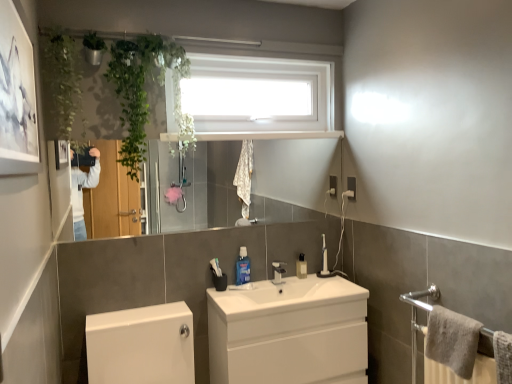
Question: Considering the relative sizes of white glossy toilet at lower left and translucent plastic bottle at center, which is the second toiletry from front to back, in the image provided, is white glossy toilet at lower left bigger than translucent plastic bottle at center, which is the second toiletry from front to back,?

Choices:
 (A) no
 (B) yes

Answer: (B)

Question: Is white glossy toilet at lower left smaller than translucent plastic bottle at center, which is the second toiletry from front to back?

Choices:
 (A) yes
 (B) no

Answer: (B)

Question: From a real-world perspective, does white glossy toilet at lower left sit lower than translucent plastic bottle at center, which is the 1th toiletry in right-to-left order?

Choices:
 (A) yes
 (B) no

Answer: (A)

Question: Does white glossy toilet at lower left lie in front of translucent plastic bottle at center, which is the 1th toiletry in right-to-left order?

Choices:
 (A) no
 (B) yes

Answer: (B)

Question: Is white glossy toilet at lower left beside translucent plastic bottle at center, which is the 1th toiletry in right-to-left order?

Choices:
 (A) no
 (B) yes

Answer: (A)

Question: Looking at their shapes, would you say white plastic window at upper center is wider or thinner than white glossy sink at center?

Choices:
 (A) thin
 (B) wide

Answer: (A)

Question: In the image, is white plastic window at upper center on the left side or the right side of white glossy sink at center?

Choices:
 (A) right
 (B) left

Answer: (B)

Question: Considering the positions of white plastic window at upper center and white glossy sink at center in the image, is white plastic window at upper center bigger or smaller than white glossy sink at center?

Choices:
 (A) small
 (B) big

Answer: (B)

Question: Considering their positions, is white plastic window at upper center located in front of or behind white glossy sink at center?

Choices:
 (A) behind
 (B) front

Answer: (A)

Question: Considering the relative positions of translucent plastic bottle at center, the second toiletry positioned from the left, and green leafy plant at upper left in the image provided, is translucent plastic bottle at center, the second toiletry positioned from the left, to the left or to the right of green leafy plant at upper left?

Choices:
 (A) right
 (B) left

Answer: (A)

Question: From the image's perspective, is translucent plastic bottle at center, which ranks as the first toiletry in back-to-front order, located above or below green leafy plant at upper left?

Choices:
 (A) below
 (B) above

Answer: (A)

Question: Looking at their shapes, would you say translucent plastic bottle at center, the second toiletry positioned from the left, is wider or thinner than green leafy plant at upper left?

Choices:
 (A) thin
 (B) wide

Answer: (A)

Question: Is translucent plastic bottle at center, which is the second toiletry from front to back, inside the boundaries of green leafy plant at upper left, or outside?

Choices:
 (A) inside
 (B) outside

Answer: (B)

Question: Considering the positions of metallic silver mirror at upper center and white glossy sink at center in the image, is metallic silver mirror at upper center wider or thinner than white glossy sink at center?

Choices:
 (A) thin
 (B) wide

Answer: (A)

Question: From a real-world perspective, is metallic silver mirror at upper center positioned above or below white glossy sink at center?

Choices:
 (A) below
 (B) above

Answer: (B)